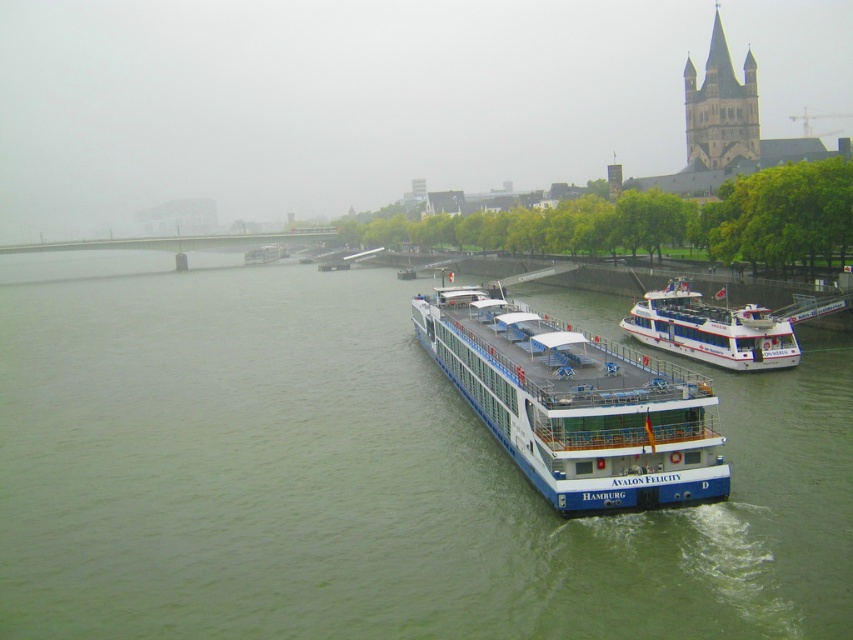
Question: Which point is farther to the camera?

Choices:
 (A) white glossy cruise ship at center
 (B) white glossy boat at center

Answer: (B)

Question: Does green water at center appear under white glossy boat at center?

Choices:
 (A) yes
 (B) no

Answer: (B)

Question: Is green water at center to the left of white glossy boat at center from the viewer's perspective?

Choices:
 (A) no
 (B) yes

Answer: (B)

Question: Does green water at center have a larger size compared to white glossy cruise ship at center?

Choices:
 (A) no
 (B) yes

Answer: (B)

Question: Estimate the real-world distances between objects in this image. Which object is closer to the white glossy cruise ship at center?

Choices:
 (A) green water at center
 (B) white glossy boat at center

Answer: (B)

Question: Which of the following is the farthest from the observer?

Choices:
 (A) white glossy boat at center
 (B) white glossy cruise ship at center
 (C) green water at center

Answer: (A)